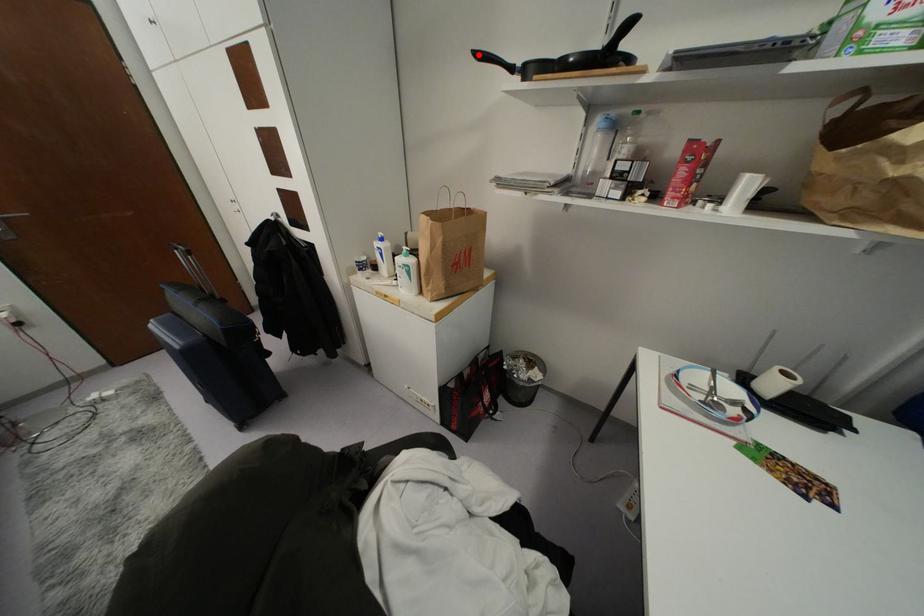
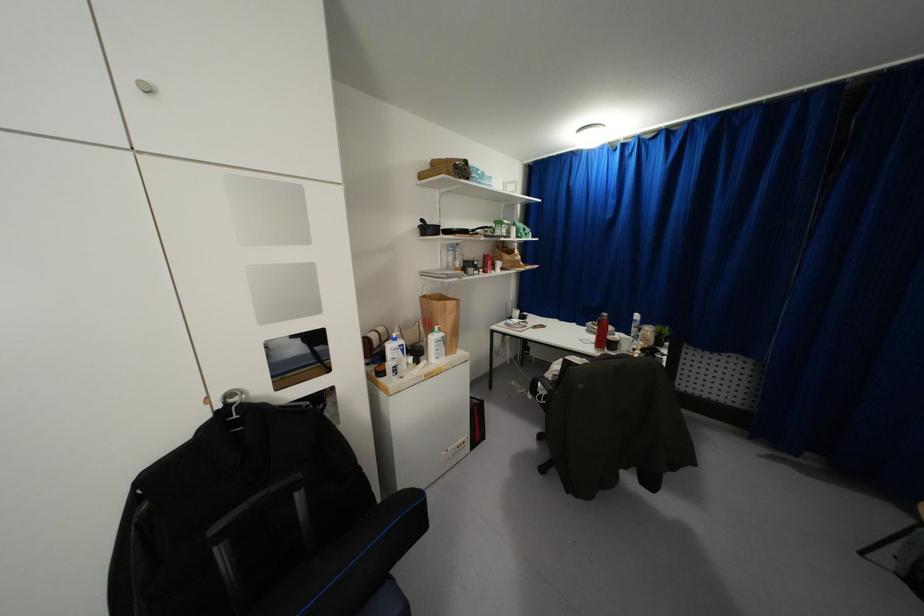
Question: I am providing you with two images of the same scene from different viewpoints. A red point is marked on the first image. At the location where the point appears in image 1, is it still visible in image 2?

Choices:
 (A) Yes
 (B) No

Answer: (A)